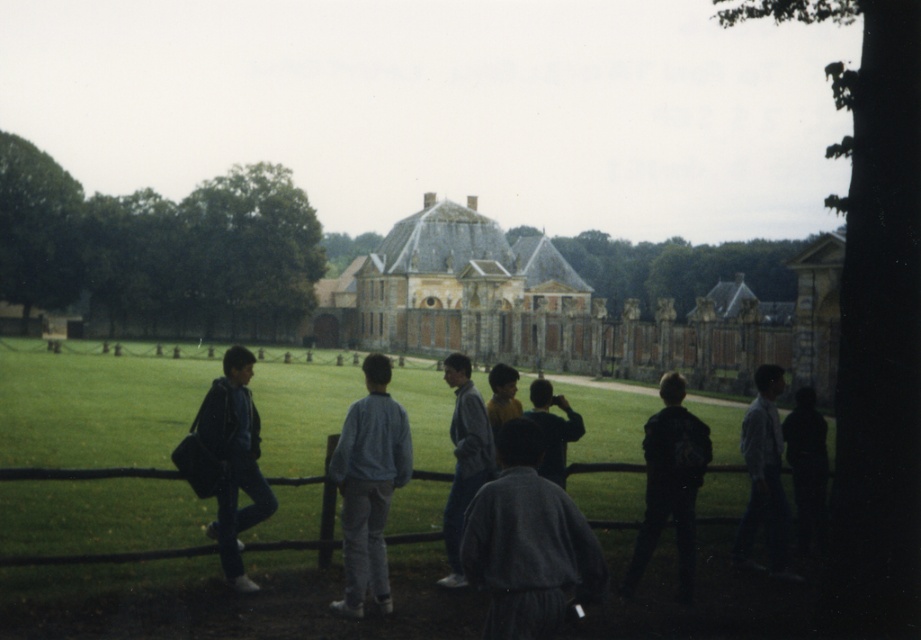
Consider the image. You are a photographer positioned on the grassy pathway near the historic building. You want to take a photo that includes both the dark blue jacket at left and the dark gray sweatshirt at center. Based on their positions, which object should you adjust your camera to focus on first to ensure both are in frame?

Since the dark blue jacket at left is to the left of the dark gray sweatshirt at center, you should focus on the dark gray sweatshirt at center first to ensure both are captured in the frame.